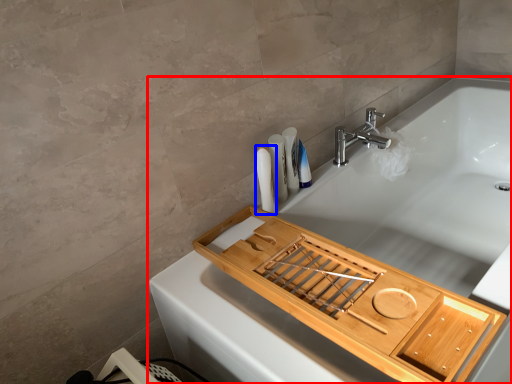
Question: Which of the following is the closest to the observer, bathtub (highlighted by a red box) or toiletry (highlighted by a blue box)?

Choices:
 (A) bathtub
 (B) toiletry

Answer: (A)